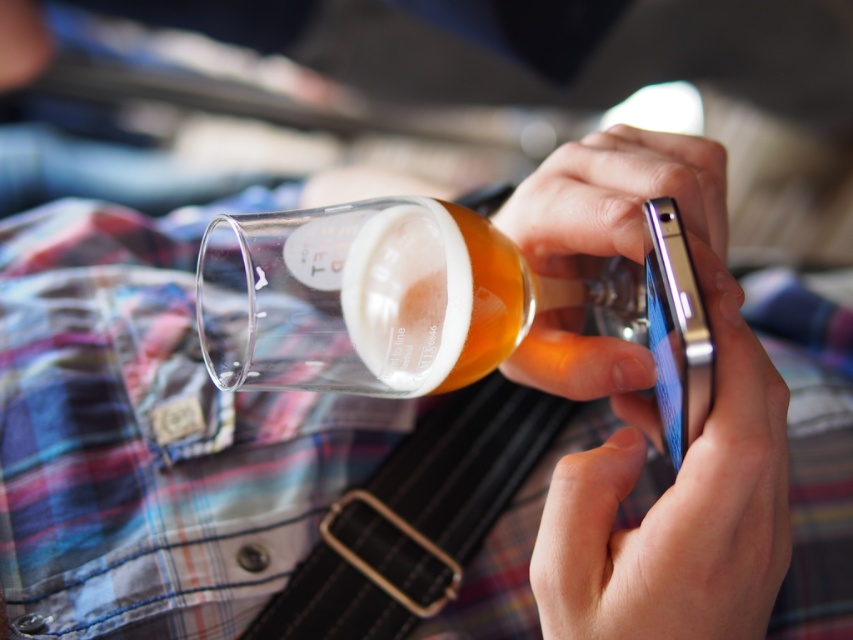
You are holding a metallic silver phone at center and a transparent glass at center. Which object is taller?

The metallic silver phone at center is taller than the transparent glass at center.

Looking at this image, you are holding a metallic silver phone at center and a transparent glass at center. Which object is closer to your fingertips?

The metallic silver phone at center is closer to your fingertips because it is located below the transparent glass at center, meaning it is positioned lower and thus nearer to your hands.